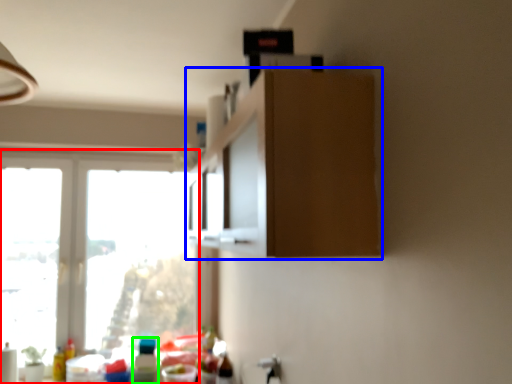
Question: Which is farther away from window (highlighted by a red box)? cabinetry (highlighted by a blue box) or bottle (highlighted by a green box)?

Choices:
 (A) cabinetry
 (B) bottle

Answer: (A)